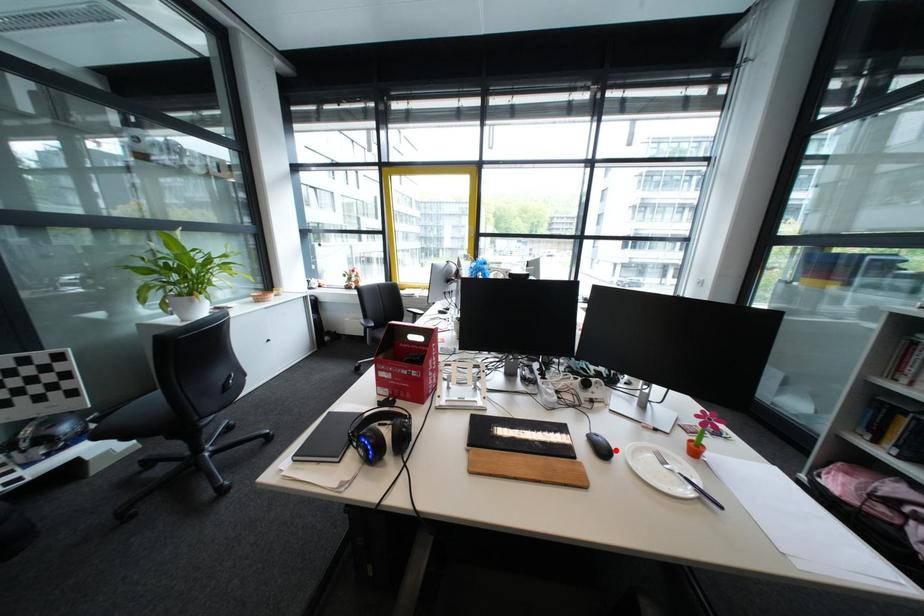
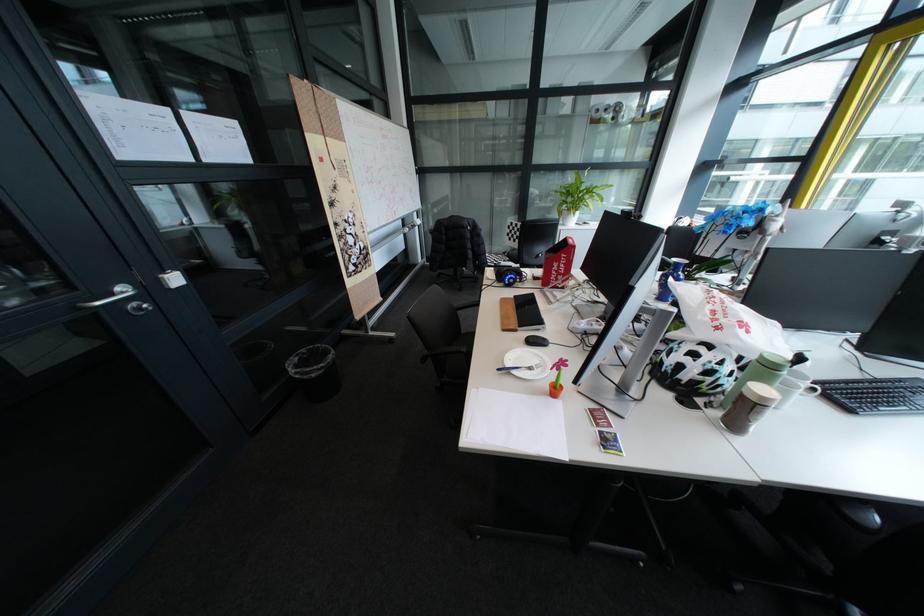
In the second image, find the point that corresponds to the highlighted location in the first image.

(546, 342)